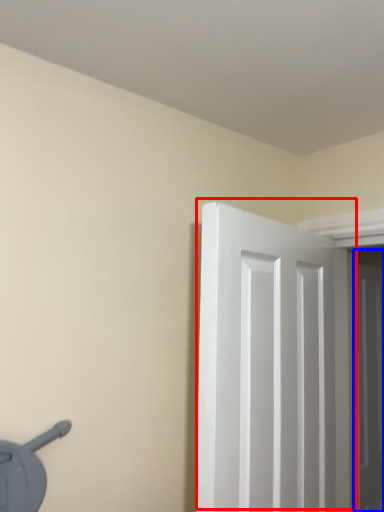
Question: Which point is closer to the camera, door (highlighted by a red box) or door (highlighted by a blue box)?

Choices:
 (A) door
 (B) door

Answer: (A)